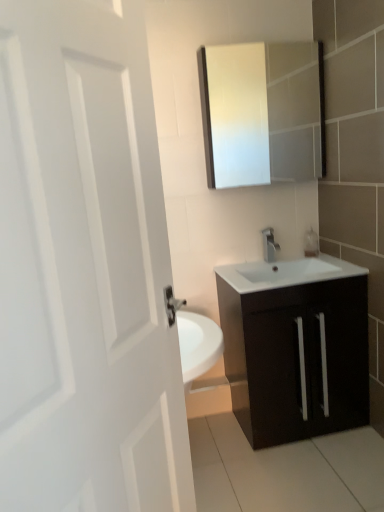
At what (x,y) coordinates should I click in order to perform the action: click on vacant area that lies between silver metallic tap at center and clear glass soap dispenser at right. Please return your answer as a coordinate pair (x, y). The image size is (384, 512). Looking at the image, I should click on (291, 259).